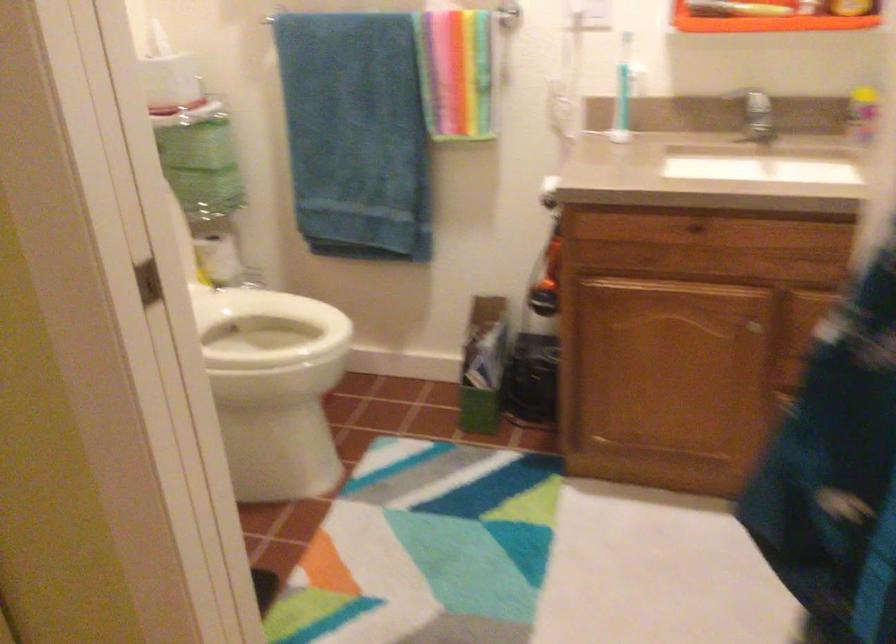
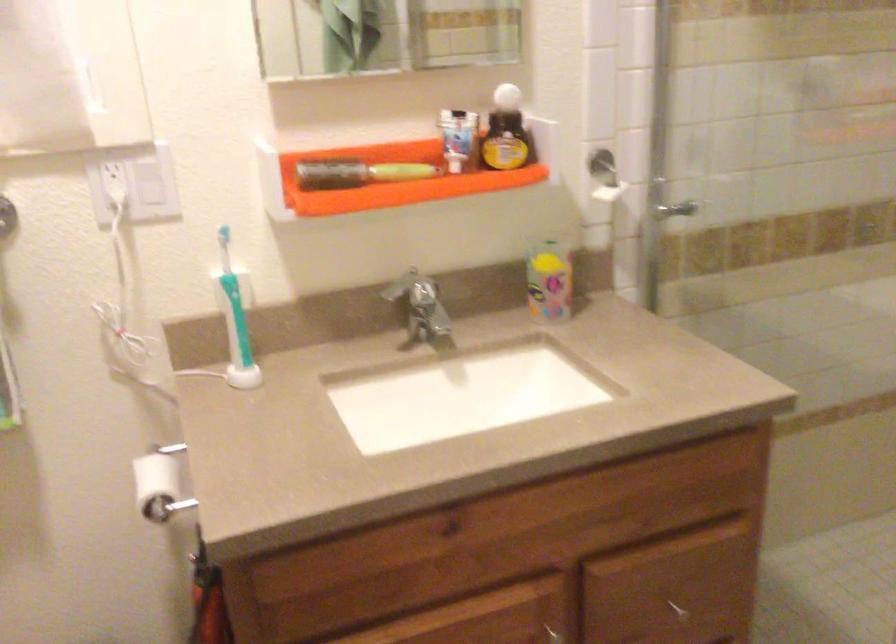
The point at (x=625, y=82) is marked in the first image. Where is the corresponding point in the second image?

(234, 304)